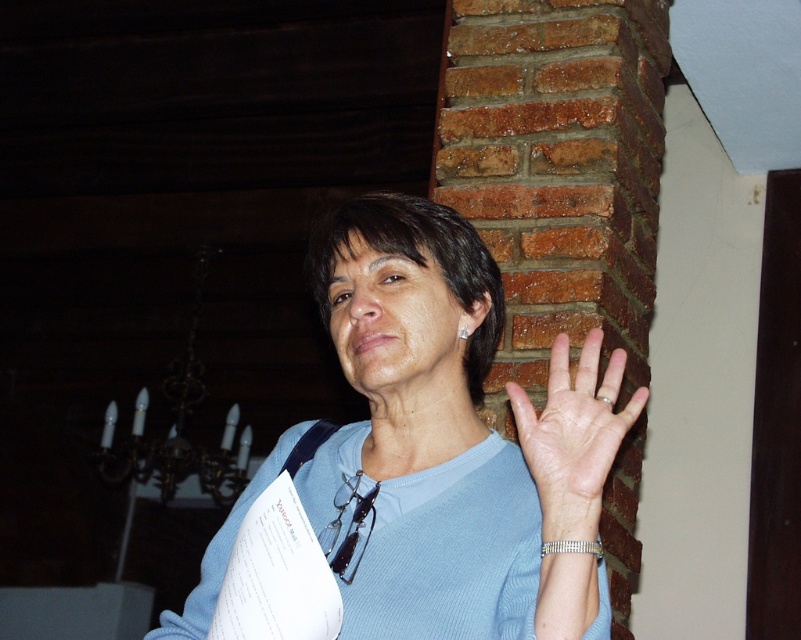
In the scene shown: Who is shorter, blue fabric shirt at center or pale skin palm at center?

With less height is pale skin palm at center.

Is point (377, 230) farther from camera compared to point (549, 364)?

Yes, point (377, 230) is behind point (549, 364).

You are a GUI agent. You are given a task and a screenshot of the screen. Output one action in this format:
    pyautogui.click(x=<x>, y=<y>)
    Task: Click on the blue fabric shirt at center
    This screenshot has height=640, width=801.
    Given the screenshot: What is the action you would take?
    pyautogui.click(x=453, y=440)